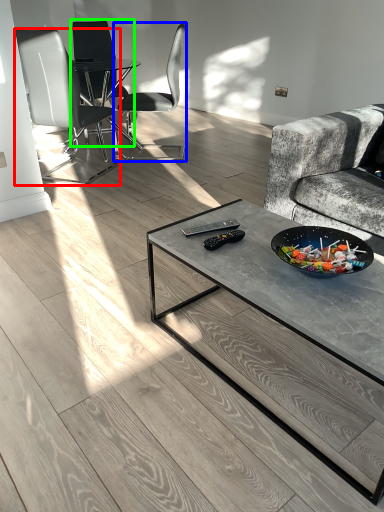
Question: Based on their relative distances, which object is nearer to chair (highlighted by a red box)? Choose from chair (highlighted by a blue box) and chair (highlighted by a green box).

Choices:
 (A) chair
 (B) chair

Answer: (B)